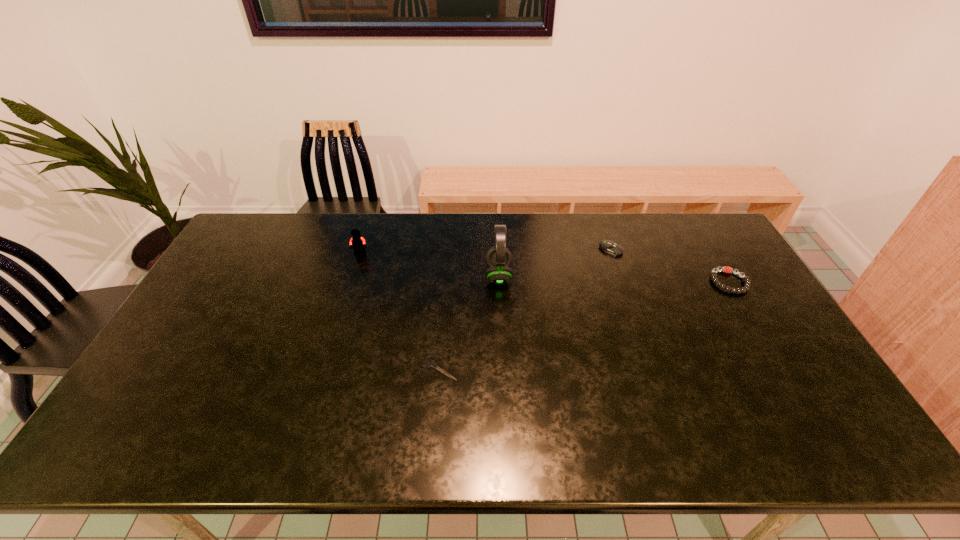
In the image, there is a desktop. Where is `blank space at the left edge`? This screenshot has width=960, height=540. blank space at the left edge is located at coordinates (156, 388).

At what (x,y) coordinates should I click in order to perform the action: click on vacant space at the right edge. Please return your answer as a coordinate pair (x, y). Image resolution: width=960 pixels, height=540 pixels. Looking at the image, I should click on (720, 279).

This screenshot has height=540, width=960. Identify the location of vacant area that lies between the tallest object and the fourth object from left to right. (555, 262).

Find the location of `free area in between the bracelet and the tallest object`. free area in between the bracelet and the tallest object is located at coordinates (614, 279).

What are the coordinates of `vacant space that's between the computer mouse and the fourth shortest object` in the screenshot? It's located at (486, 252).

Locate an element on the screen. The width and height of the screenshot is (960, 540). free space between the nearest object and the bracelet is located at coordinates (585, 325).

This screenshot has width=960, height=540. I want to click on vacant point located between the shortest object and the third object from right to left, so click(469, 322).

What are the coordinates of `empty location between the third object from left to right and the rightmost object` in the screenshot? It's located at (614, 279).

Image resolution: width=960 pixels, height=540 pixels. I want to click on free point between the Lego and the fourth object from right to left, so click(x=400, y=311).

You are a GUI agent. You are given a task and a screenshot of the screen. Output one action in this format:
    pyautogui.click(x=<x>, y=<y>)
    Task: Click on the vacant area between the tallest object and the shortest object
    The image size is (960, 540).
    Given the screenshot: What is the action you would take?
    pyautogui.click(x=469, y=322)